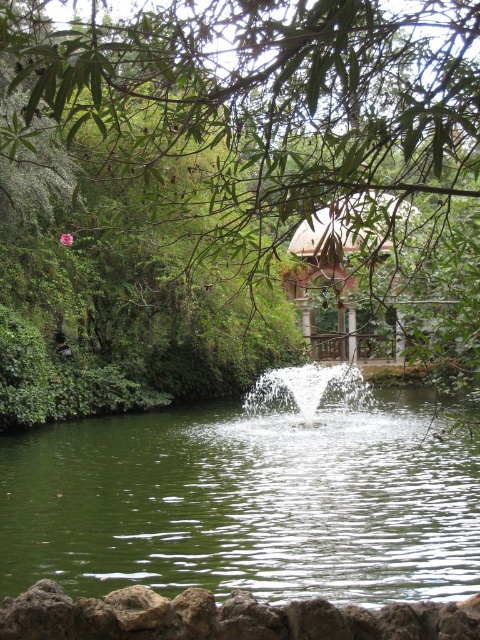
You are a landscape architect designing a garden path that needs to be 2 meters wide. You observe the green leafy tree at center and the green liquid water at center in the garden scene. Which object should you avoid placing the path near to ensure it meets the width requirement?

The green leafy tree at center is thinner than green liquid water at center. Therefore, to ensure the path is 2 meters wide, you should avoid placing it near the green leafy tree at center since it is narrower than the water area.

You are planning to place a new bench in the garden. The bench is 2 meters wide. You want to place it next to the green leafy tree at center and the wooden gazebo at center. Which object should you place it next to so that the bench fits without overlapping?

The green leafy tree at center is wider than the wooden gazebo at center. Since the bench is 2 meters wide, it should be placed next to the green leafy tree at center as it has more space.